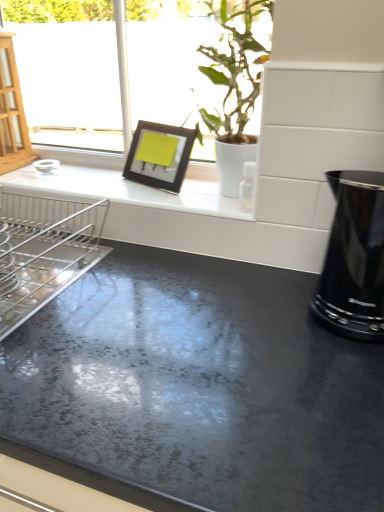
Question: From the image's perspective, is black glossy kettle at right on top of black matte picture frame at upper center?

Choices:
 (A) no
 (B) yes

Answer: (A)

Question: From a real-world perspective, is black glossy kettle at right physically above black matte picture frame at upper center?

Choices:
 (A) yes
 (B) no

Answer: (B)

Question: Is black glossy kettle at right at the right side of black matte picture frame at upper center?

Choices:
 (A) no
 (B) yes

Answer: (B)

Question: Is black glossy kettle at right positioned beyond the bounds of black matte picture frame at upper center?

Choices:
 (A) no
 (B) yes

Answer: (B)

Question: Is the depth of black glossy kettle at right greater than that of black matte picture frame at upper center?

Choices:
 (A) no
 (B) yes

Answer: (A)

Question: Does black glossy kettle at right have a greater height compared to black matte picture frame at upper center?

Choices:
 (A) no
 (B) yes

Answer: (B)

Question: From the image's perspective, is black glossy kettle at right below silver metallic dish rack at left?

Choices:
 (A) no
 (B) yes

Answer: (B)

Question: From a real-world perspective, is black glossy kettle at right on top of silver metallic dish rack at left?

Choices:
 (A) yes
 (B) no

Answer: (A)

Question: Can you confirm if black glossy kettle at right is positioned to the left of silver metallic dish rack at left?

Choices:
 (A) yes
 (B) no

Answer: (B)

Question: Can you confirm if black glossy kettle at right is wider than silver metallic dish rack at left?

Choices:
 (A) no
 (B) yes

Answer: (A)

Question: From the image's perspective, is black glossy kettle at right above silver metallic dish rack at left?

Choices:
 (A) yes
 (B) no

Answer: (B)

Question: Can you confirm if black glossy kettle at right is shorter than silver metallic dish rack at left?

Choices:
 (A) no
 (B) yes

Answer: (A)

Question: Are silver metallic dish rack at left and black matte picture frame at upper center beside each other?

Choices:
 (A) yes
 (B) no

Answer: (B)